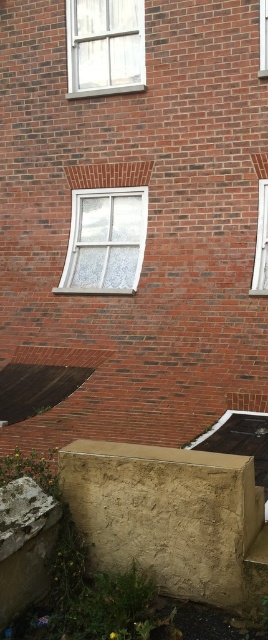
You are an architect examining the brick building. You need to determine which window has a greater height between the white glass window at right and the clear glass window at upper right without measuring tools. Based on the description, which one is taller?

The white glass window at right is taller than the clear glass window at upper right according to the description.

You are an architect inspecting the brick building. You notice two windows, the white glass window at right and the clear glass window at upper right. Which window has a greater width?

The white glass window at right has a greater width than the clear glass window at upper right according to the description.

You are standing in front of a brick building and want to determine the relative positions of two points marked on the wall. The points are labeled as point 1 at coordinates (91, 83) and point 2 at (262, 36). From your perspective, which point is closer to you?

Point 1 at coordinates (91, 83) is closer to you because it is further to the camera than point 2 at (262, 36).